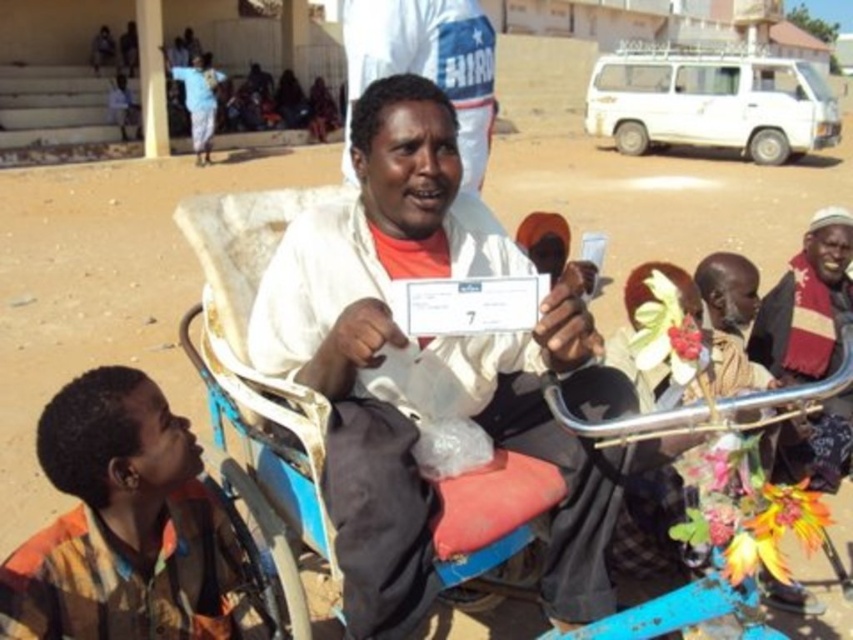
Does multicolored fabric shirt at lower left have a greater width compared to blue metallic cart at center?

No, multicolored fabric shirt at lower left is not wider than blue metallic cart at center.

Which is in front, point (114, 464) or point (469, 548)?

Point (114, 464) is more forward.

What are the coordinates of `multicolored fabric shirt at lower left` in the screenshot? It's located at (120, 524).

What do you see at coordinates (428, 368) in the screenshot? Image resolution: width=853 pixels, height=640 pixels. I see `white matte shirt at center` at bounding box center [428, 368].

From the picture: Is white matte shirt at center to the right of multicolored fabric shirt at lower left from the viewer's perspective?

Correct, you'll find white matte shirt at center to the right of multicolored fabric shirt at lower left.

Where is `white matte shirt at center`? The height and width of the screenshot is (640, 853). white matte shirt at center is located at coordinates (428, 368).

Find the location of `white matte shirt at center`. white matte shirt at center is located at coordinates (428, 368).

Does white matte shirt at center appear on the left side of blue metallic cart at center?

Incorrect, white matte shirt at center is not on the left side of blue metallic cart at center.

Find the location of `white matte shirt at center`. white matte shirt at center is located at coordinates (428, 368).

Is point (379, 211) in front of point (622, 634)?

No.

Locate an element on the screen. This screenshot has width=853, height=640. white matte shirt at center is located at coordinates (428, 368).